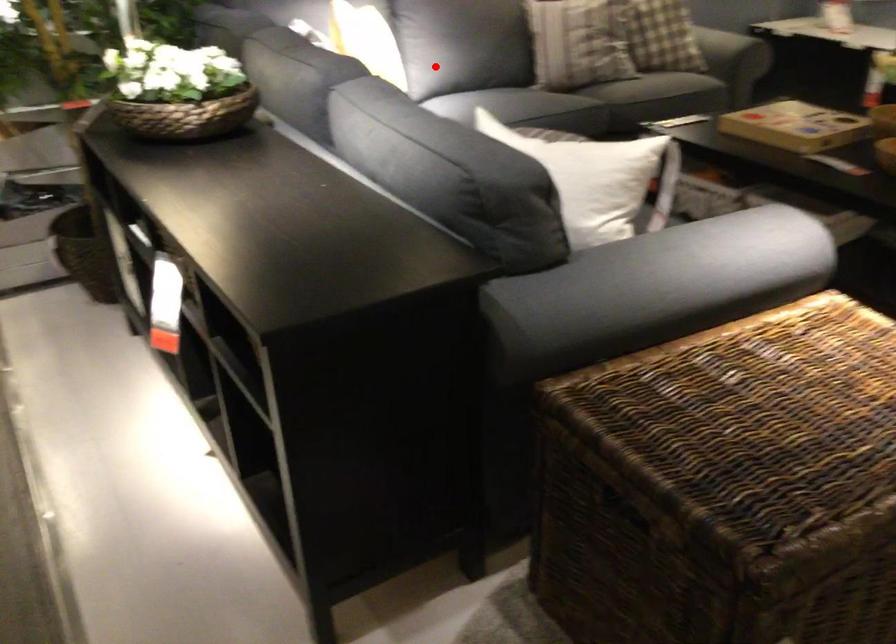
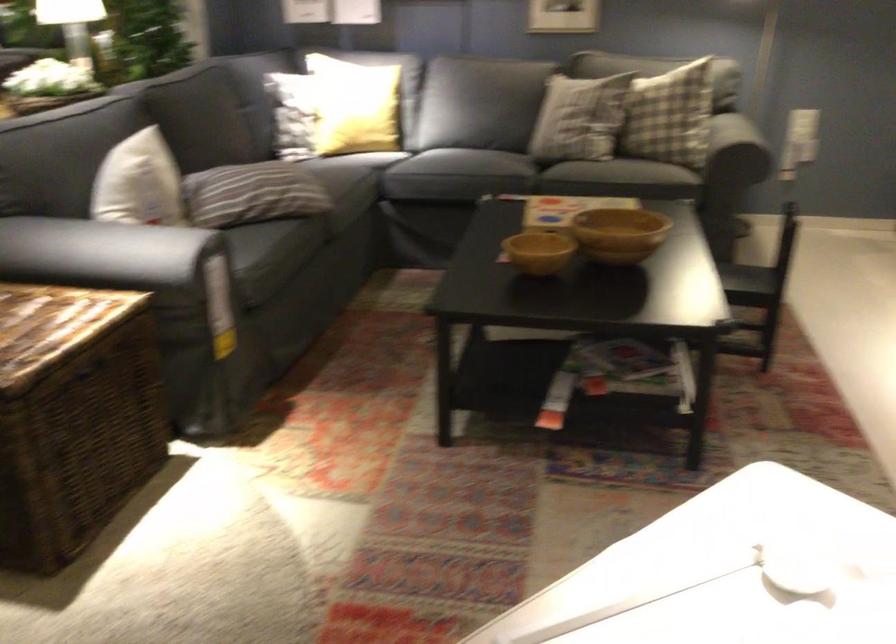
The point at the highlighted location is marked in the first image. Where is the corresponding point in the second image?

(352, 106)